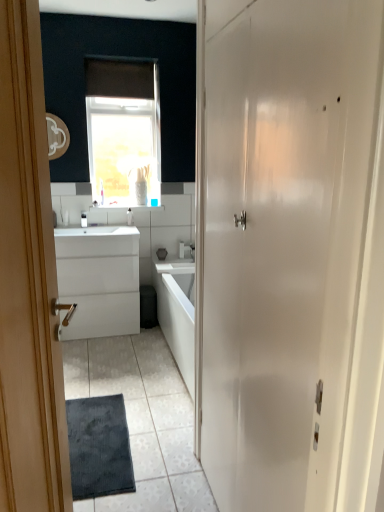
Locate an element on the screen. free point above dark gray textured mat at lower left (from a real-world perspective) is located at coordinates (114, 400).